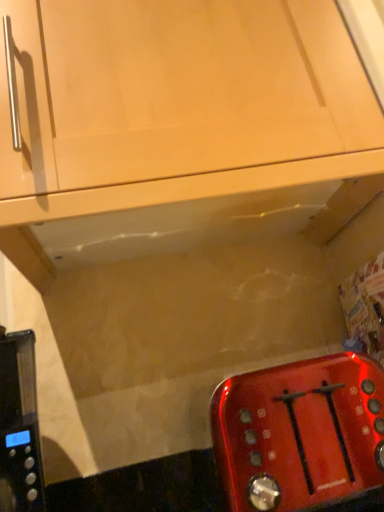
Question: Considering the relative sizes of matte wood cabinet at upper center and shiny metallic toaster at lower right in the image provided, is matte wood cabinet at upper center taller than shiny metallic toaster at lower right?

Choices:
 (A) yes
 (B) no

Answer: (A)

Question: Is the depth of matte wood cabinet at upper center greater than that of shiny metallic toaster at lower right?

Choices:
 (A) no
 (B) yes

Answer: (B)

Question: From a real-world perspective, is matte wood cabinet at upper center positioned over shiny metallic toaster at lower right based on gravity?

Choices:
 (A) yes
 (B) no

Answer: (A)

Question: Does matte wood cabinet at upper center have a smaller size compared to shiny metallic toaster at lower right?

Choices:
 (A) no
 (B) yes

Answer: (A)

Question: Considering the relative sizes of matte wood cabinet at upper center and shiny metallic toaster at lower right in the image provided, is matte wood cabinet at upper center shorter than shiny metallic toaster at lower right?

Choices:
 (A) no
 (B) yes

Answer: (A)

Question: Is matte wood cabinet at upper center facing towards shiny metallic toaster at lower right?

Choices:
 (A) no
 (B) yes

Answer: (A)

Question: Is matte wood cabinet at upper center inside shiny metallic toaster at lower right?

Choices:
 (A) yes
 (B) no

Answer: (B)

Question: Is shiny metallic toaster at lower right with matte wood cabinet at upper center?

Choices:
 (A) yes
 (B) no

Answer: (B)

Question: Is shiny metallic toaster at lower right bigger than matte wood cabinet at upper center?

Choices:
 (A) yes
 (B) no

Answer: (B)

Question: Can you confirm if shiny metallic toaster at lower right is wider than matte wood cabinet at upper center?

Choices:
 (A) no
 (B) yes

Answer: (A)

Question: Is shiny metallic toaster at lower right facing away from matte wood cabinet at upper center?

Choices:
 (A) no
 (B) yes

Answer: (A)

Question: Is shiny metallic toaster at lower right closer to the viewer compared to matte wood cabinet at upper center?

Choices:
 (A) no
 (B) yes

Answer: (B)

Question: Looking at the image, does shiny metallic toaster at lower right seem bigger or smaller compared to matte wood cabinet at upper center?

Choices:
 (A) big
 (B) small

Answer: (B)